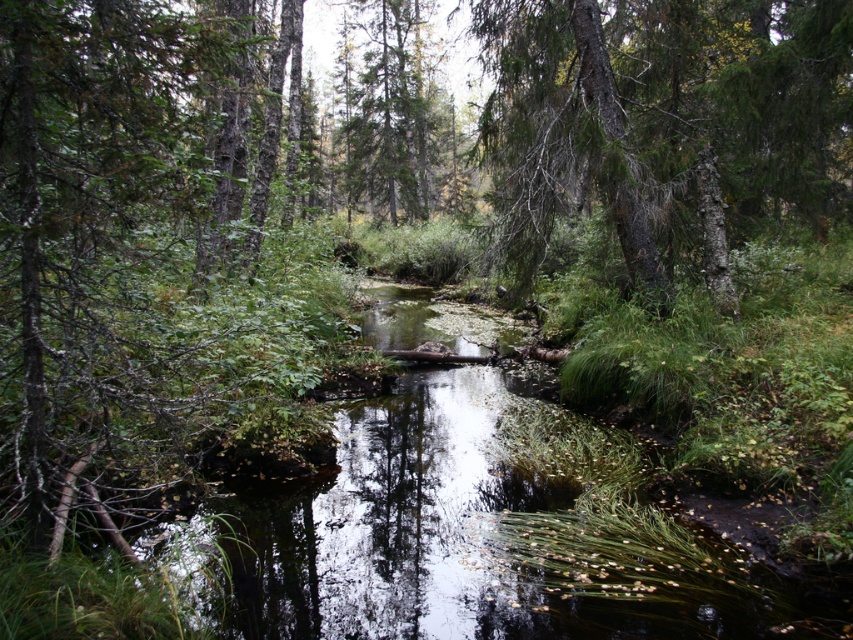
Question: Which point is farther from the camera taking this photo?

Choices:
 (A) (476, 369)
 (B) (746, 132)

Answer: (A)

Question: Which object is closer to the camera taking this photo?

Choices:
 (A) clear water at center
 (B) green textured tree at upper center

Answer: (A)

Question: Can you confirm if clear water at center is smaller than green textured tree at upper center?

Choices:
 (A) no
 (B) yes

Answer: (B)

Question: Which point is closer to the camera?

Choices:
 (A) (782, 54)
 (B) (602, 580)

Answer: (B)

Question: Is clear water at center thinner than green textured tree at upper center?

Choices:
 (A) yes
 (B) no

Answer: (A)

Question: Does clear water at center appear under green textured tree at upper center?

Choices:
 (A) no
 (B) yes

Answer: (B)